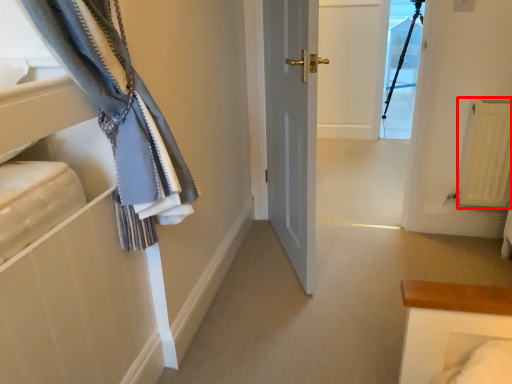
Question: From the image's perspective, what is the correct spatial positioning of radiator (annotated by the red box) in reference to glass door?

Choices:
 (A) above
 (B) below

Answer: (B)